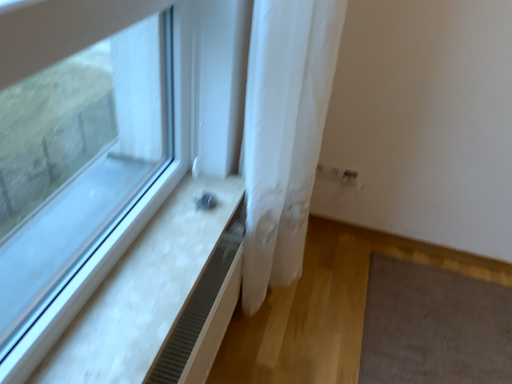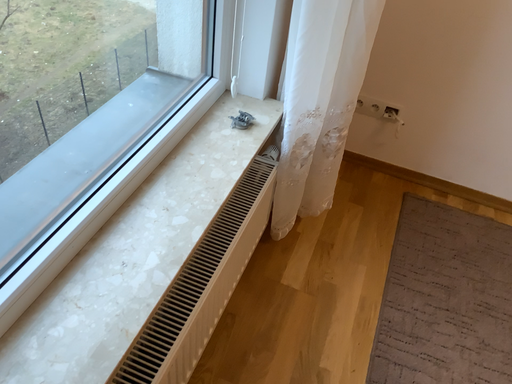
Question: Which way did the camera rotate in the video?

Choices:
 (A) rotated downward
 (B) rotated upward

Answer: (A)